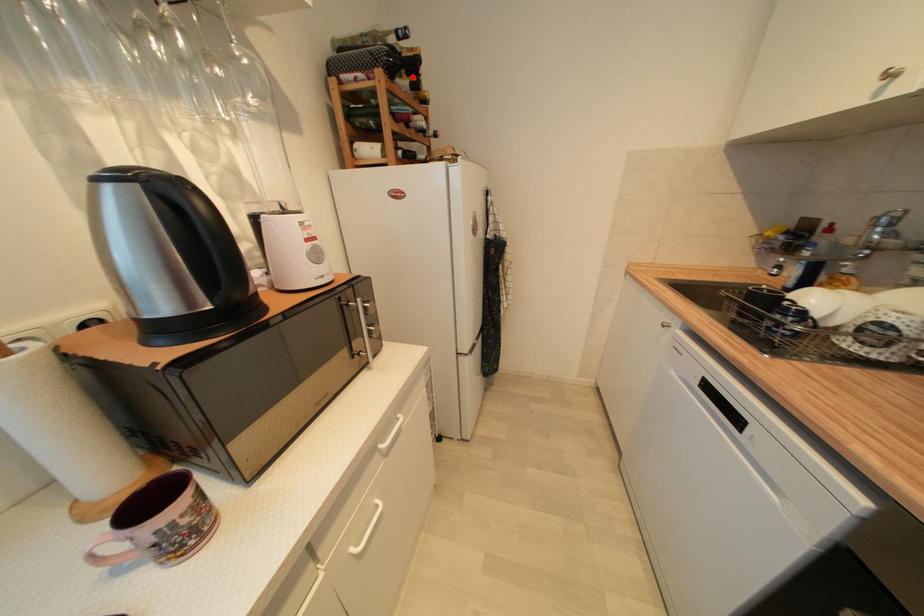
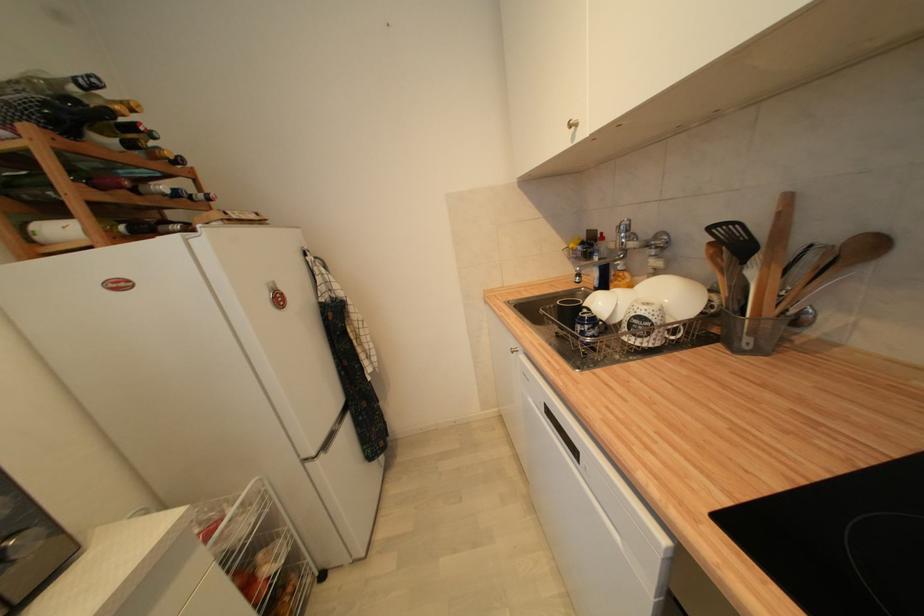
In the second image, find the point that corresponds to the highlighted location in the first image.

(128, 132)